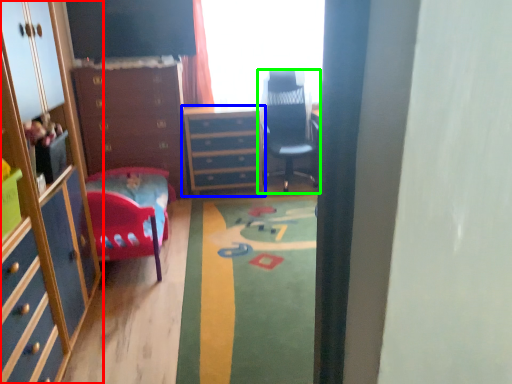
Question: Considering the real-world distances, which object is closest to cabinetry (highlighted by a red box)? chest of drawers (highlighted by a blue box) or chair (highlighted by a green box).

Choices:
 (A) chest of drawers
 (B) chair

Answer: (A)